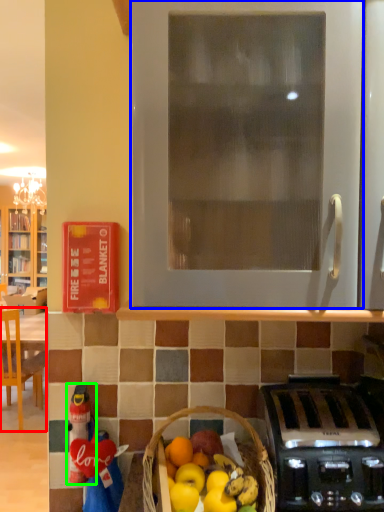
Question: Estimate the real-world distances between objects in this image. Which object is farther from chair (highlighted by a red box), oven (highlighted by a blue box) or toy (highlighted by a green box)?

Choices:
 (A) oven
 (B) toy

Answer: (A)